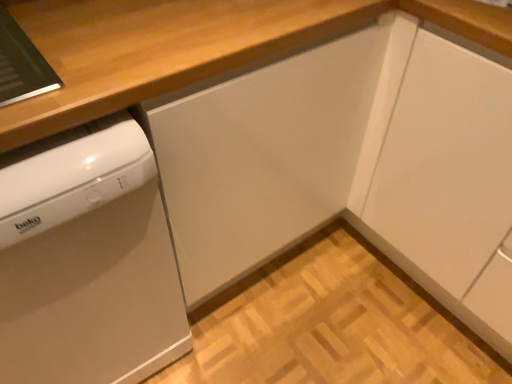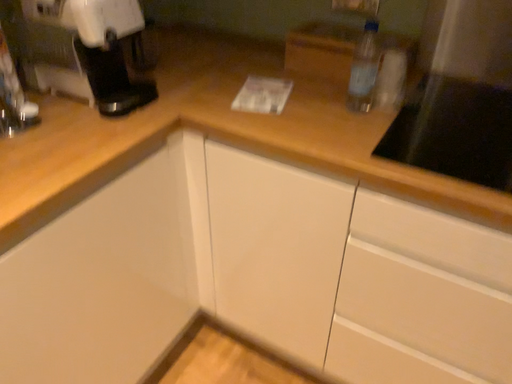
Question: How did the camera likely rotate when shooting the video?

Choices:
 (A) rotated upward
 (B) rotated downward

Answer: (A)